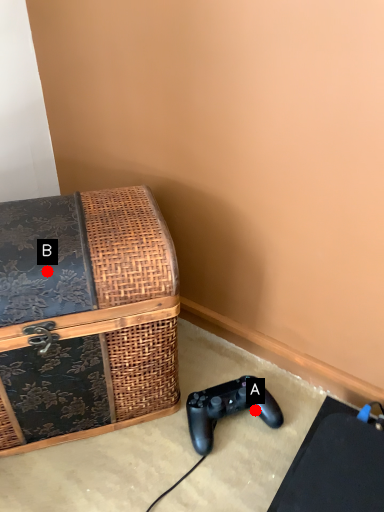
Question: Two points are circled on the image, labeled by A and B beside each circle. Which point appears farthest from the camera in this image?

Choices:
 (A) A is further
 (B) B is further

Answer: (A)